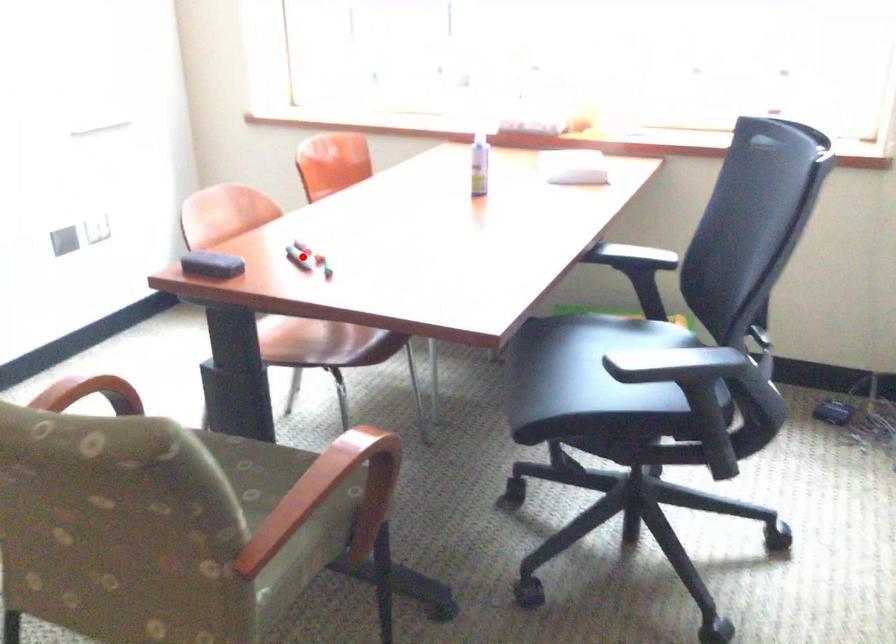
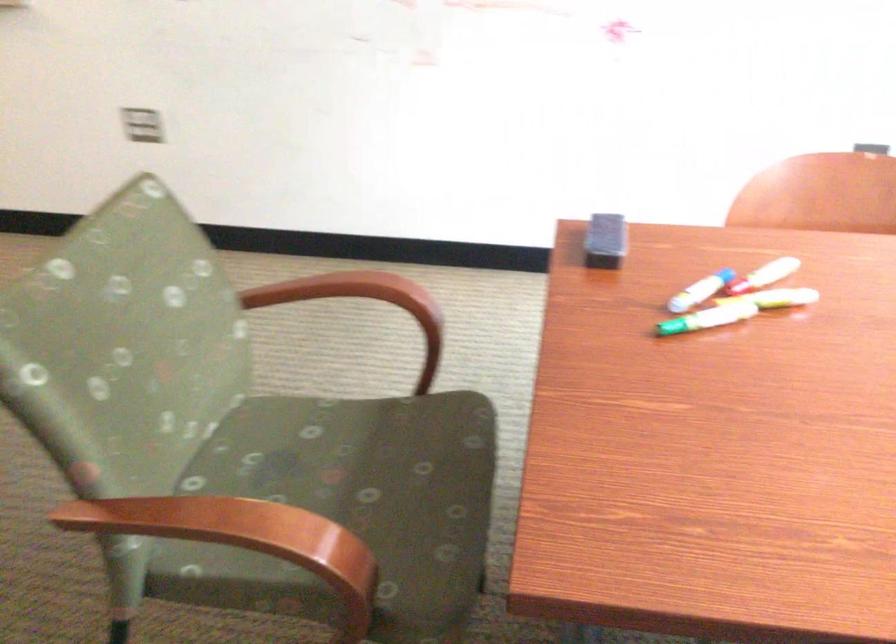
Question: I am providing you with two images of the same scene from different viewpoints. Given a red point in image1, look at the same physical point in image2. Is it:

Choices:
 (A) Closer to the viewpoint
 (B) Farther from the viewpoint

Answer: (A)